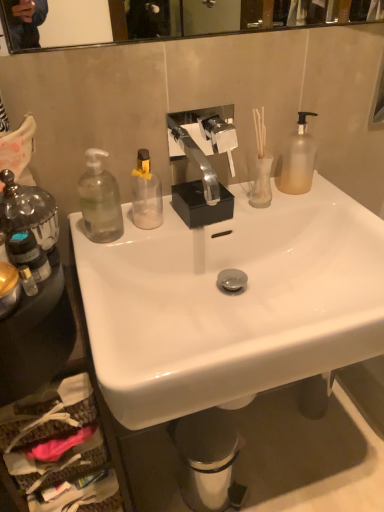
Question: Is point (18, 229) closer or farther from the camera than point (114, 196)?

Choices:
 (A) farther
 (B) closer

Answer: (B)

Question: Is translucent plastic bottle at left, which is counted as the 4th bottle, starting from the right, bigger or smaller than transparent glass soap dispenser at left, acting as the fourth bottle starting from the left?

Choices:
 (A) big
 (B) small

Answer: (B)

Question: Which object is positioned farthest from the clear glass bottle at left, which is counted as the fifth bottle, starting from the right?

Choices:
 (A) translucent glass vase at upper right
 (B) metallic silver trash can at lower center
 (C) white glossy sink at center
 (D) transparent glass soap dispenser at left, which is the 2th bottle from right to left
 (E) translucent glass bottle at left, the third bottle when ordered from left to right

Answer: (B)

Question: Which object is positioned farthest from the frosted glass soap dispenser at right, the first bottle when ordered from right to left?

Choices:
 (A) metallic silver trash can at lower center
 (B) transparent glass soap dispenser at left, acting as the fourth bottle starting from the left
 (C) translucent glass vase at upper right
 (D) translucent plastic bottle at left, which is counted as the 4th bottle, starting from the right
 (E) white glossy sink at center

Answer: (A)